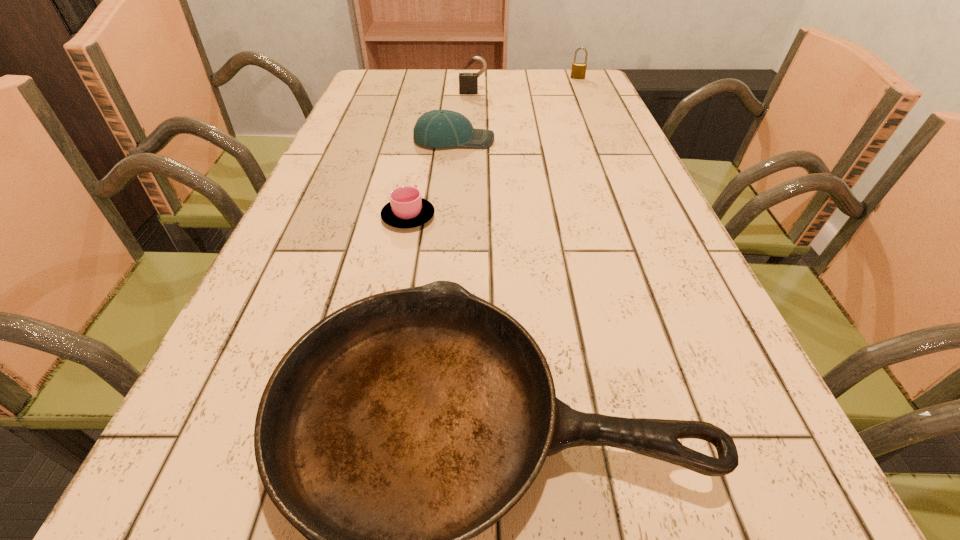
The width and height of the screenshot is (960, 540). I want to click on free space located 0.110m on the side with the handle of the cup, so click(x=417, y=174).

Find the location of a particular element. free spot located on the side with the handle of the cup is located at coordinates (415, 184).

In order to click on vacant space located 0.190m on the side with the handle of the cup in this screenshot , I will do `click(420, 157)`.

Image resolution: width=960 pixels, height=540 pixels. I want to click on object present at the right edge, so click(x=578, y=71).

Locate an element on the screen. This screenshot has width=960, height=540. object that is at the far right corner is located at coordinates (578, 71).

Identify the location of free location at the left edge. (330, 233).

In the image, there is a desktop. Where is `vacant space at the right edge`? vacant space at the right edge is located at coordinates (577, 143).

The width and height of the screenshot is (960, 540). In the image, there is a desktop. Find the location of `blank space at the far left corner`. blank space at the far left corner is located at coordinates (394, 76).

Identify the location of vacant area that lies between the third nearest object and the farthest object. (516, 109).

You are a GUI agent. You are given a task and a screenshot of the screen. Output one action in this format:
    pyautogui.click(x=<x>, y=<y>)
    Task: Click on the empty space between the baseball cap and the rightmost object
    
    Given the screenshot: What is the action you would take?
    pyautogui.click(x=516, y=109)